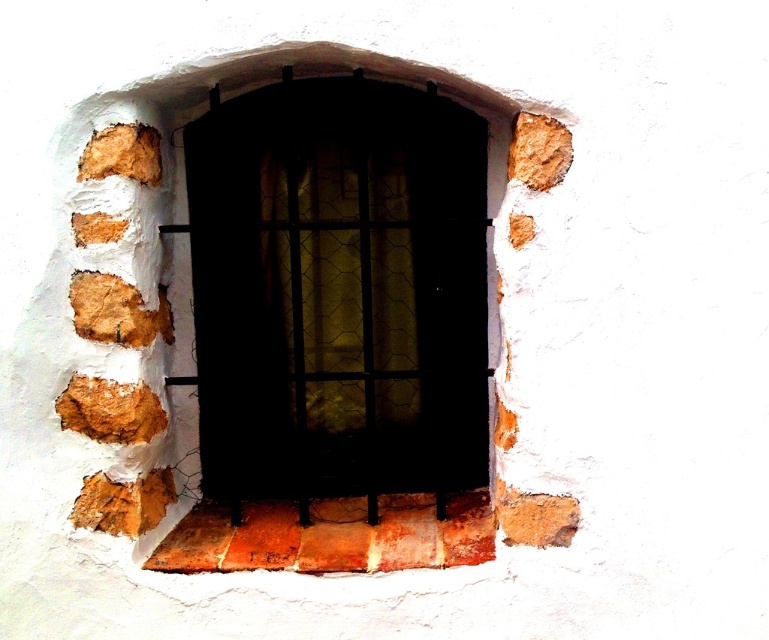
Which is in front, point (425, 100) or point (208, 561)?

Point (208, 561) is in front.

Consider the image. Does matte black window at center have a greater width compared to rusty brick at center?

No, matte black window at center is not wider than rusty brick at center.

Image resolution: width=769 pixels, height=640 pixels. In order to click on matte black window at center in this screenshot , I will do [338, 291].